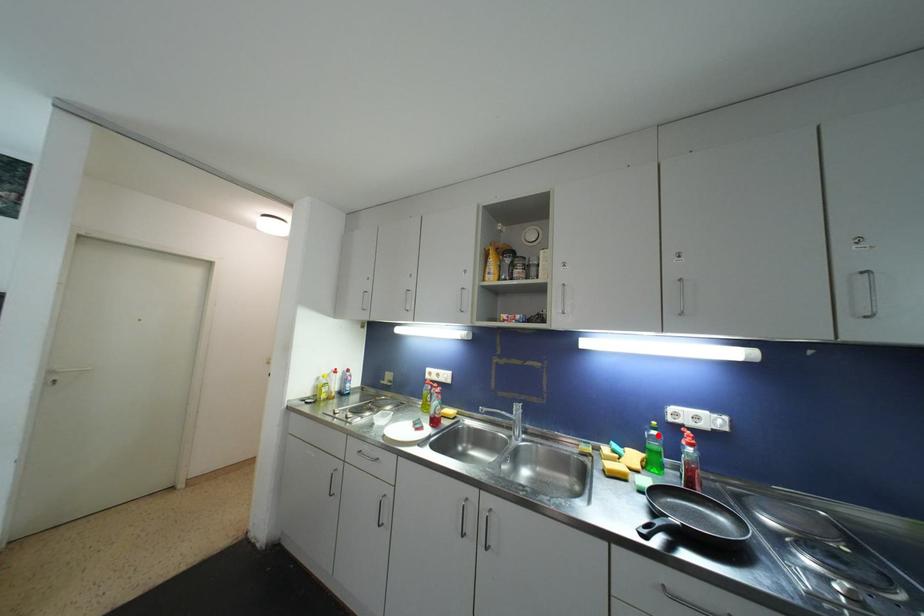
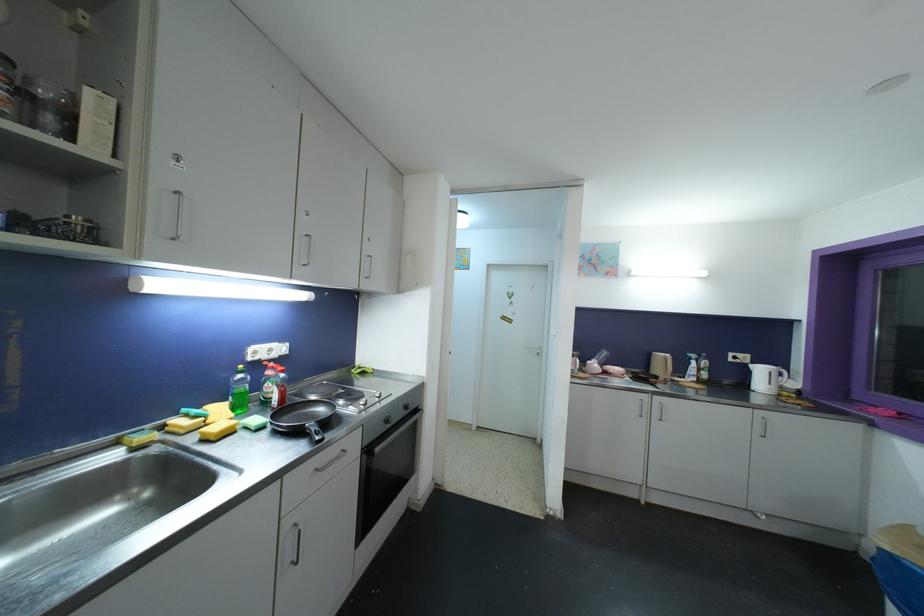
Find the pixel in the second image that matches the highlighted location in the first image.

(244, 379)